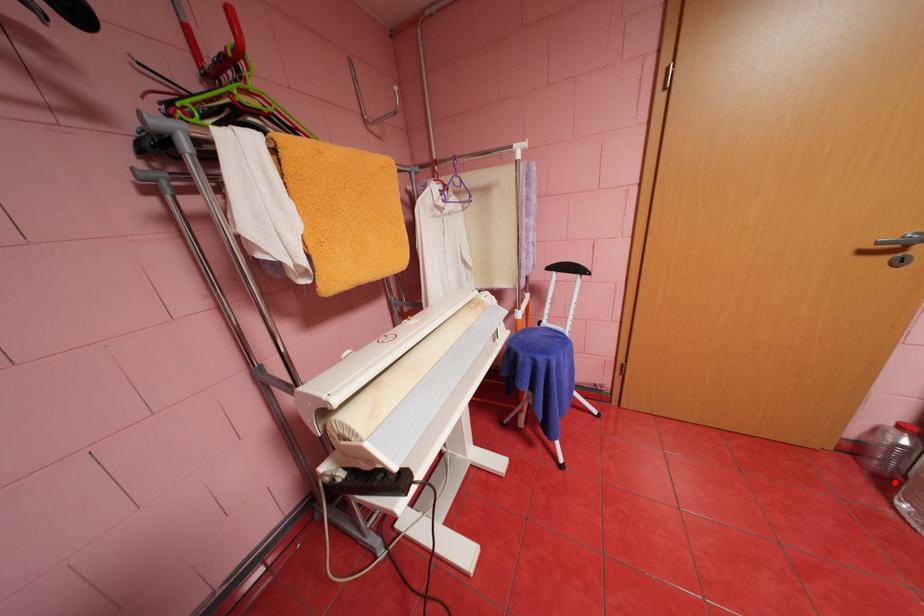
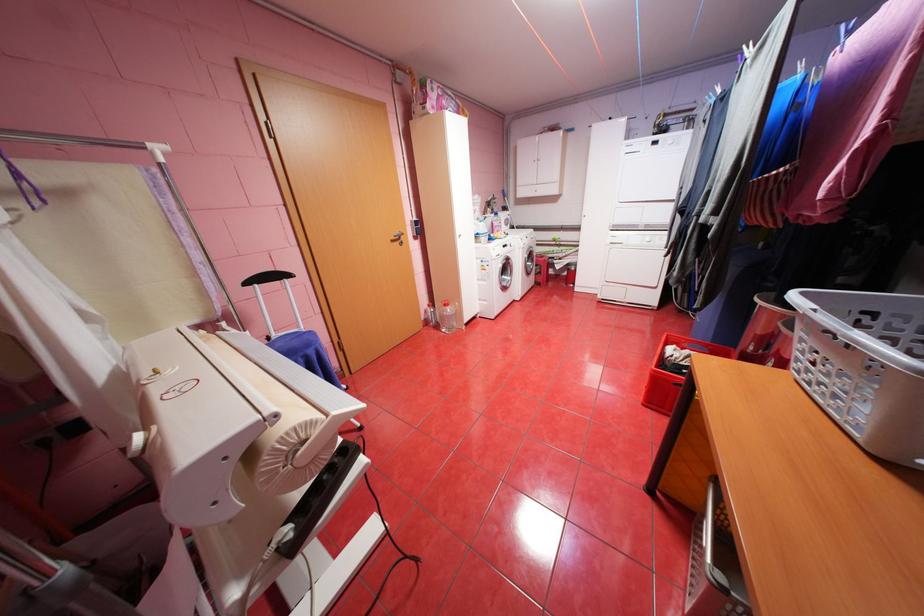
Find the pixel in the second image that matches the highlighted location in the first image.

(445, 326)